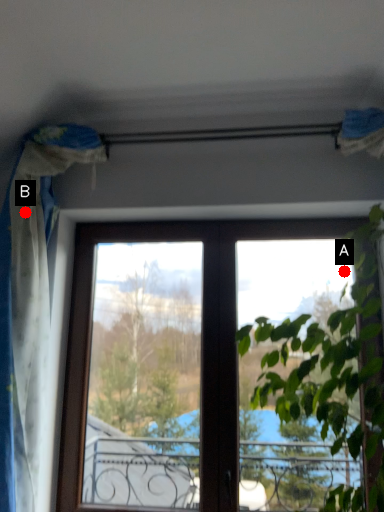
Question: Two points are circled on the image, labeled by A and B beside each circle. Which point appears closest to the camera in this image?

Choices:
 (A) A is closer
 (B) B is closer

Answer: (A)